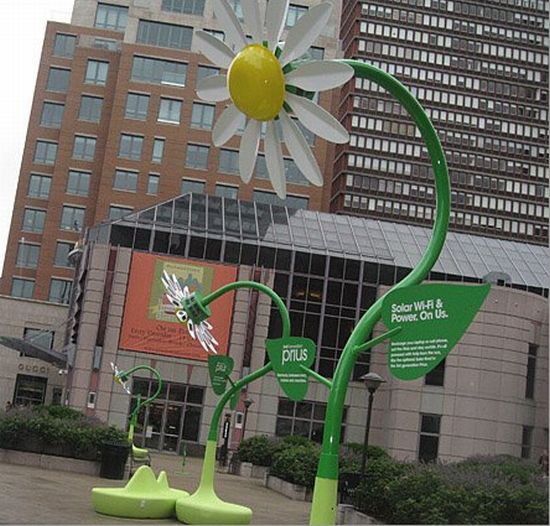
Find the location of a particular element. The width and height of the screenshot is (550, 526). place to sit is located at coordinates (131, 460), (138, 450), (139, 497), (211, 510).